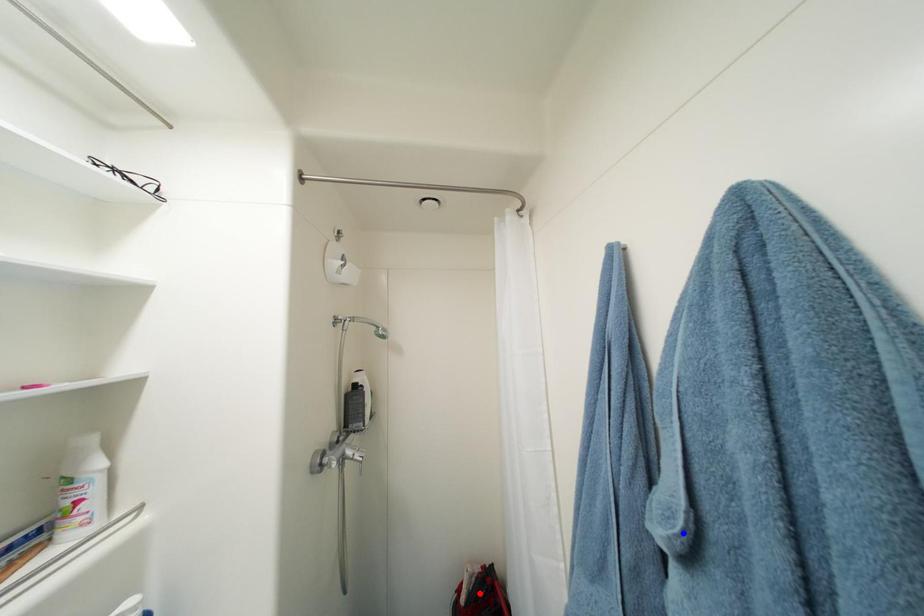
Question: Two points are marked on the image. Which point is closer to the camera?

Choices:
 (A) Blue point is closer.
 (B) Red point is closer.

Answer: (A)